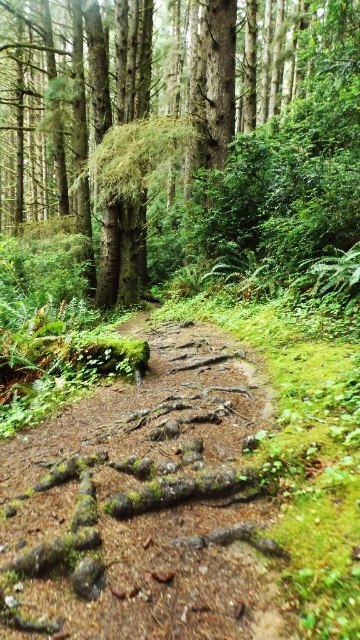
Question: Can you confirm if green mossy tree at center is positioned above mossy dirt path at center?

Choices:
 (A) yes
 (B) no

Answer: (A)

Question: Which object appears closest to the camera in this image?

Choices:
 (A) green mossy tree at center
 (B) mossy dirt path at center

Answer: (B)

Question: Does green mossy tree at center appear on the right side of mossy dirt path at center?

Choices:
 (A) no
 (B) yes

Answer: (A)

Question: Which point is closer to the camera?

Choices:
 (A) (132, 42)
 (B) (6, 573)

Answer: (B)

Question: Which point appears farthest from the camera in this image?

Choices:
 (A) (293, 186)
 (B) (38, 544)

Answer: (A)

Question: Where is green mossy tree at center located in relation to mossy dirt path at center in the image?

Choices:
 (A) right
 (B) left

Answer: (B)